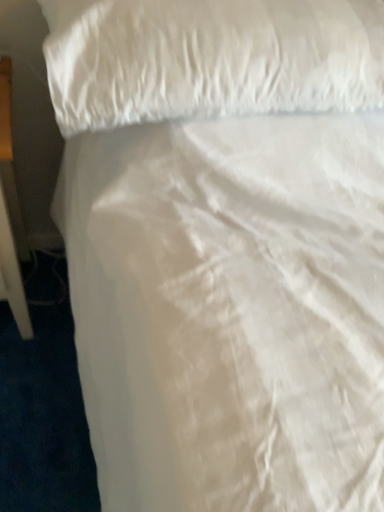
Measure the distance between white satin pillow at upper center and camera.

24.83 inches.

What do you see at coordinates (209, 59) in the screenshot? The width and height of the screenshot is (384, 512). I see `white satin pillow at upper center` at bounding box center [209, 59].

This screenshot has height=512, width=384. Identify the location of white satin pillow at upper center. (209, 59).

This screenshot has height=512, width=384. Identify the location of white satin pillow at upper center. (209, 59).